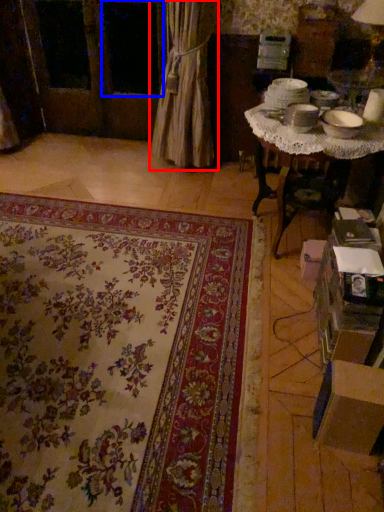
Question: Among these objects, which one is nearest to the camera, curtain (highlighted by a red box) or window (highlighted by a blue box)?

Choices:
 (A) curtain
 (B) window

Answer: (A)